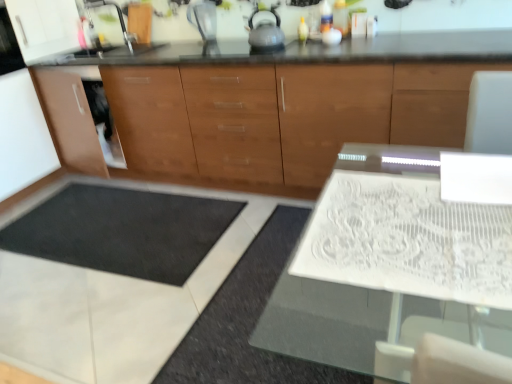
Question: Would you say satin silver tea pot at upper center is a long distance from transparent plastic blender at upper center?

Choices:
 (A) yes
 (B) no

Answer: (B)

Question: From the image's perspective, is satin silver tea pot at upper center located beneath transparent plastic blender at upper center?

Choices:
 (A) yes
 (B) no

Answer: (A)

Question: Can you confirm if satin silver tea pot at upper center is wider than transparent plastic blender at upper center?

Choices:
 (A) yes
 (B) no

Answer: (A)

Question: Is satin silver tea pot at upper center next to transparent plastic blender at upper center and touching it?

Choices:
 (A) no
 (B) yes

Answer: (A)

Question: Does satin silver tea pot at upper center have a larger size compared to transparent plastic blender at upper center?

Choices:
 (A) no
 (B) yes

Answer: (A)

Question: From a real-world perspective, is satin silver tea pot at upper center positioned over transparent plastic blender at upper center based on gravity?

Choices:
 (A) no
 (B) yes

Answer: (A)

Question: Is satin silver tea pot at upper center directly adjacent to brown wood cabinet at center?

Choices:
 (A) no
 (B) yes

Answer: (A)

Question: Is satin silver tea pot at upper center positioned far away from brown wood cabinet at center?

Choices:
 (A) no
 (B) yes

Answer: (A)

Question: Can you confirm if satin silver tea pot at upper center is thinner than brown wood cabinet at center?

Choices:
 (A) yes
 (B) no

Answer: (A)

Question: Is brown wood cabinet at center at the back of satin silver tea pot at upper center?

Choices:
 (A) no
 (B) yes

Answer: (A)

Question: Is satin silver tea pot at upper center aimed at brown wood cabinet at center?

Choices:
 (A) yes
 (B) no

Answer: (B)

Question: Is satin silver tea pot at upper center at the right side of brown wood cabinet at center?

Choices:
 (A) yes
 (B) no

Answer: (A)

Question: Is brown wood cabinet at center smaller than transparent plastic blender at upper center?

Choices:
 (A) no
 (B) yes

Answer: (A)